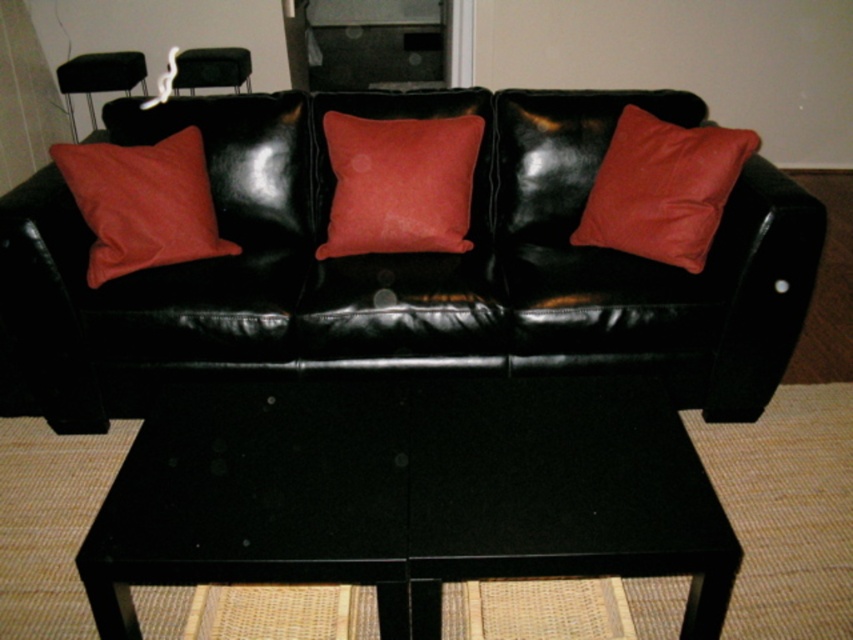
Is point (376, 218) positioned in front of point (213, 221)?

Yes, point (376, 218) is in front of point (213, 221).

Does suede-like coral cushion at center have a greater width compared to matte red pillow at left?

Correct, the width of suede-like coral cushion at center exceeds that of matte red pillow at left.

This screenshot has height=640, width=853. I want to click on suede-like coral cushion at center, so 399,182.

Does suede-like coral cushion at center appear on the right side of matte black chair at upper left?

Correct, you'll find suede-like coral cushion at center to the right of matte black chair at upper left.

How much distance is there between suede-like coral cushion at center and matte black chair at upper left?

The distance of suede-like coral cushion at center from matte black chair at upper left is 1.90 meters.

The width and height of the screenshot is (853, 640). I want to click on suede-like coral cushion at center, so click(x=399, y=182).

Between velvet red pillow at right and matte black chair at upper left, which one has less height?

matte black chair at upper left is shorter.

Find the location of a particular element. The height and width of the screenshot is (640, 853). velvet red pillow at right is located at coordinates (662, 188).

Image resolution: width=853 pixels, height=640 pixels. I want to click on velvet red pillow at right, so click(x=662, y=188).